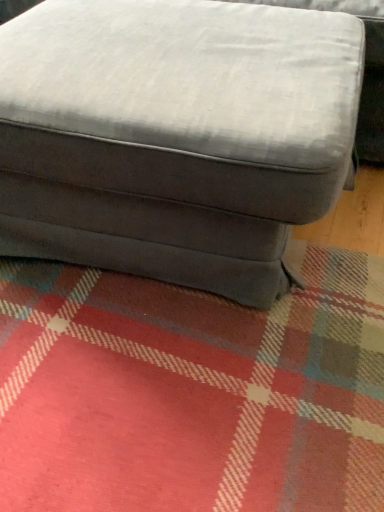
Question: Should I look upward or downward to see gray fabric ottoman at center?

Choices:
 (A) down
 (B) up

Answer: (B)